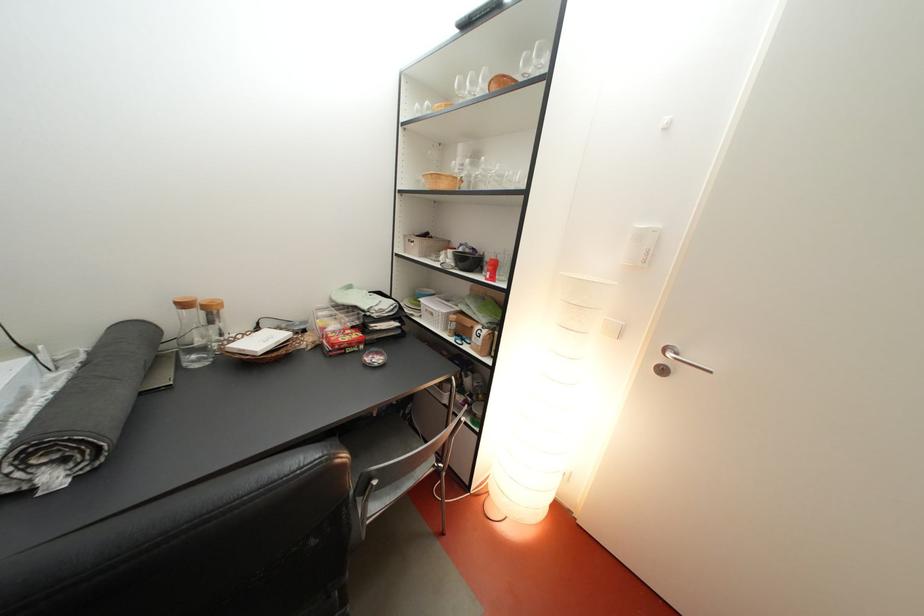
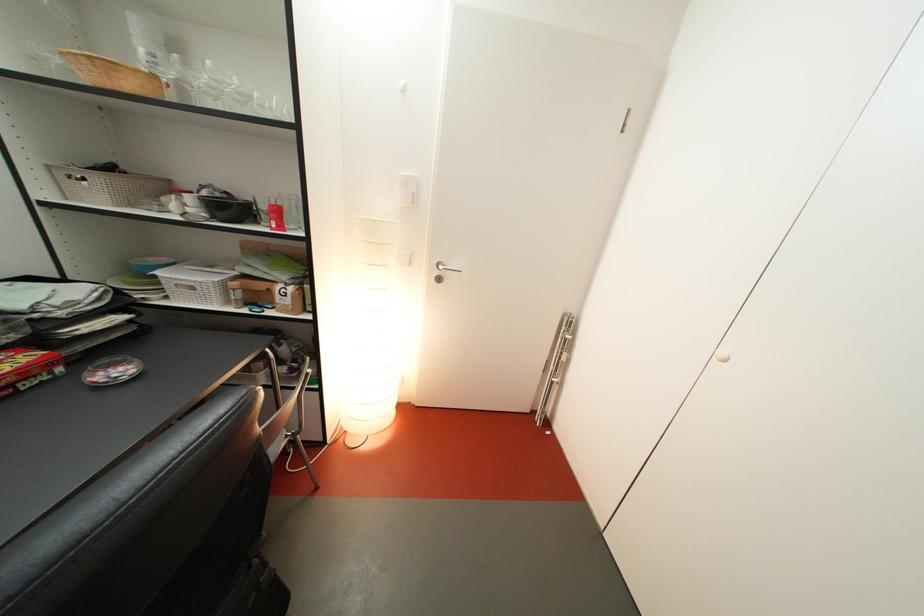
The images are taken continuously from a first-person perspective. In which direction is your viewpoint rotating?

The camera rotated toward right-down.